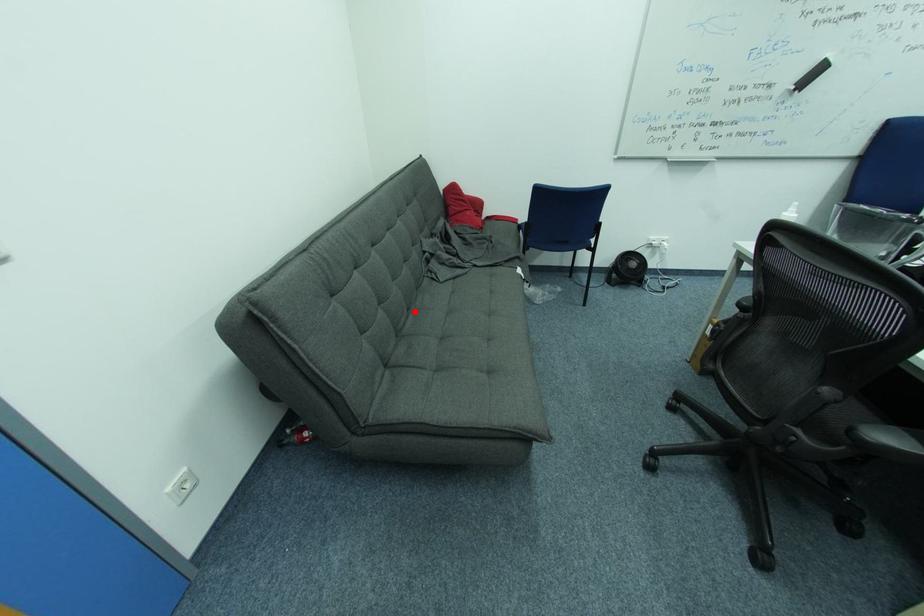
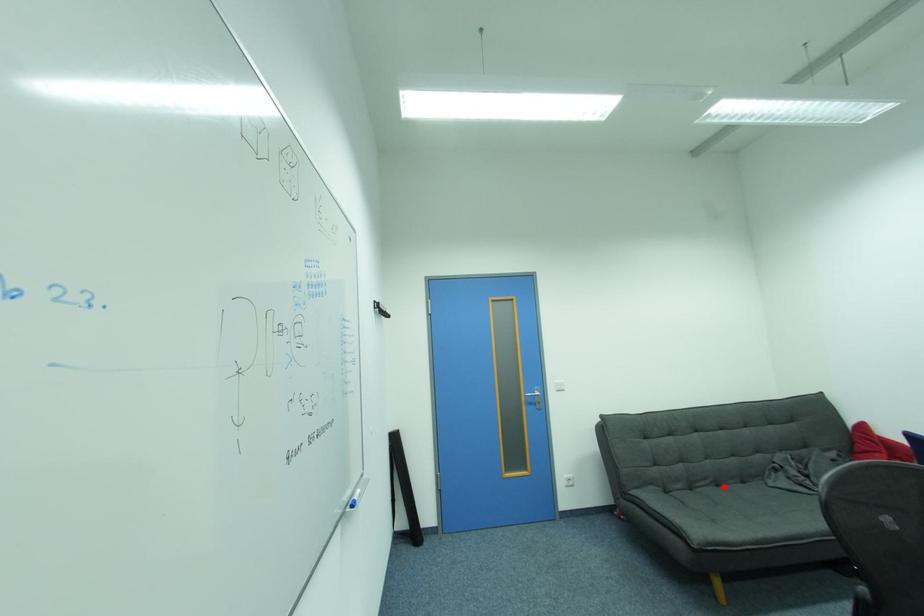
I am providing you with two images of the same scene from different viewpoints. A red point is marked on the first image and another point is marked on the second image. Is the red point in image1 aligned with the point shown in image2?

Yes